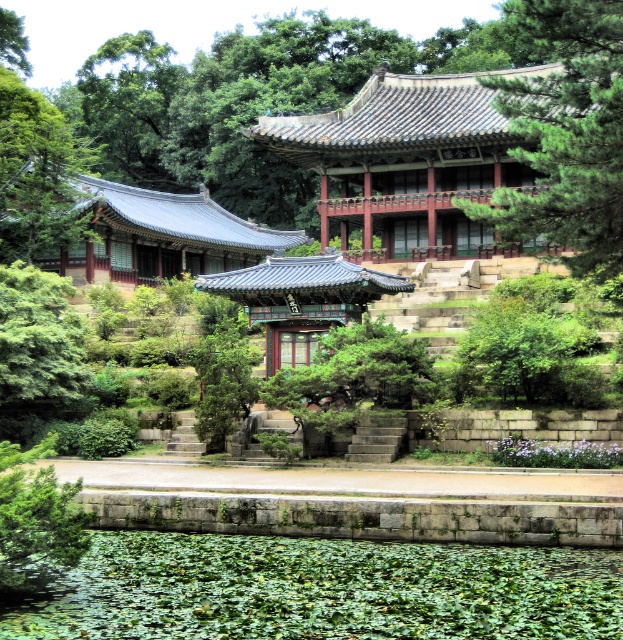
Question: Is green leafy water at lower center thinner than green textured pine tree at upper right?

Choices:
 (A) yes
 (B) no

Answer: (A)

Question: Estimate the real-world distances between objects in this image. Which object is farther from the green leafy tree at upper left?

Choices:
 (A) green leafy water at lower center
 (B) green textured pine tree at upper right

Answer: (A)

Question: Can you confirm if green leafy water at lower center is wider than green textured pine tree at upper right?

Choices:
 (A) no
 (B) yes

Answer: (A)

Question: Which object is closer to the camera taking this photo?

Choices:
 (A) green leafy tree at upper left
 (B) green leafy water at lower center
 (C) green textured pine tree at upper right

Answer: (B)

Question: Among these points, which one is nearest to the camera?

Choices:
 (A) tap(93, 577)
 (B) tap(169, 49)

Answer: (A)

Question: Does green textured pine tree at upper right appear over green leafy tree at upper left?

Choices:
 (A) yes
 (B) no

Answer: (B)